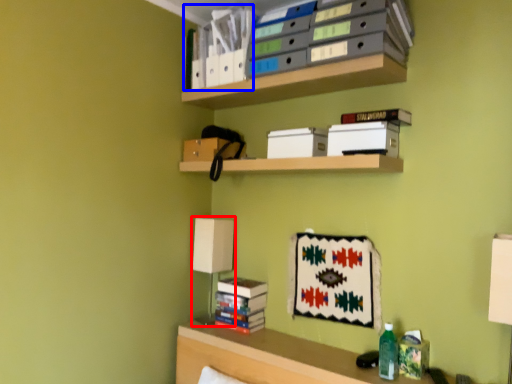
Question: Which object appears farthest to the camera in this image, table lamp (highlighted by a red box) or book (highlighted by a blue box)?

Choices:
 (A) table lamp
 (B) book

Answer: (A)